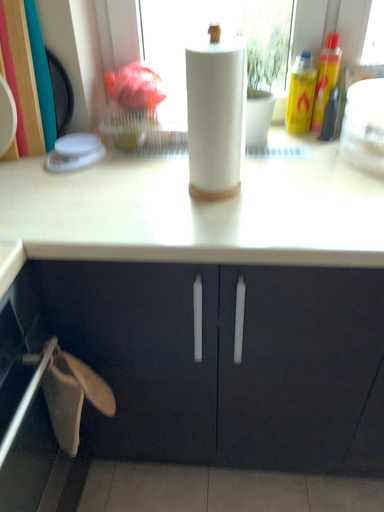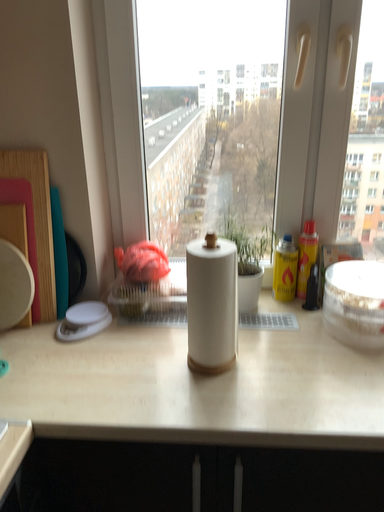
Question: How did the camera likely rotate when shooting the video?

Choices:
 (A) rotated upward
 (B) rotated downward

Answer: (A)